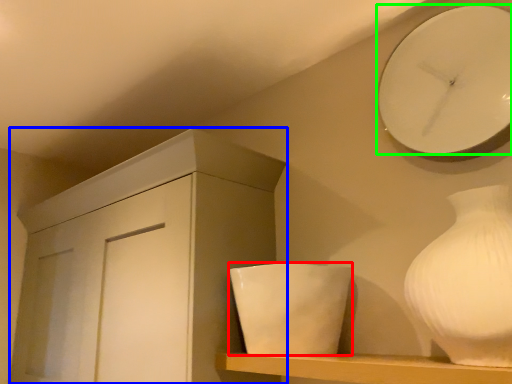
Question: Which is nearer to the ceramic (highlighted by a red box)? cabinetry (highlighted by a blue box) or wall clock (highlighted by a green box).

Choices:
 (A) cabinetry
 (B) wall clock

Answer: (A)